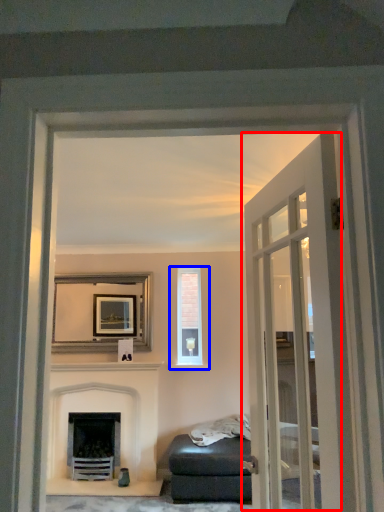
Question: Which point is further to the camera, door (highlighted by a red box) or window (highlighted by a blue box)?

Choices:
 (A) door
 (B) window

Answer: (B)